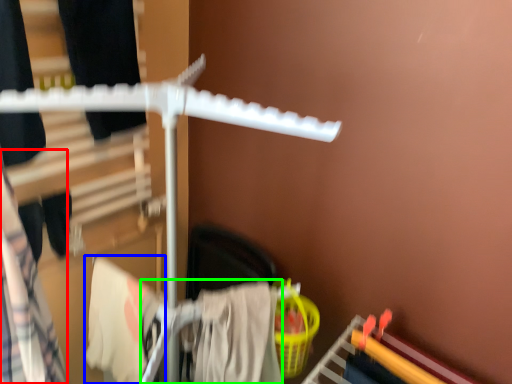
Question: Based on their relative distances, which object is farther from clothing (highlighted by a red box)? Choose from clothing (highlighted by a blue box) and clothing (highlighted by a green box).

Choices:
 (A) clothing
 (B) clothing

Answer: (B)